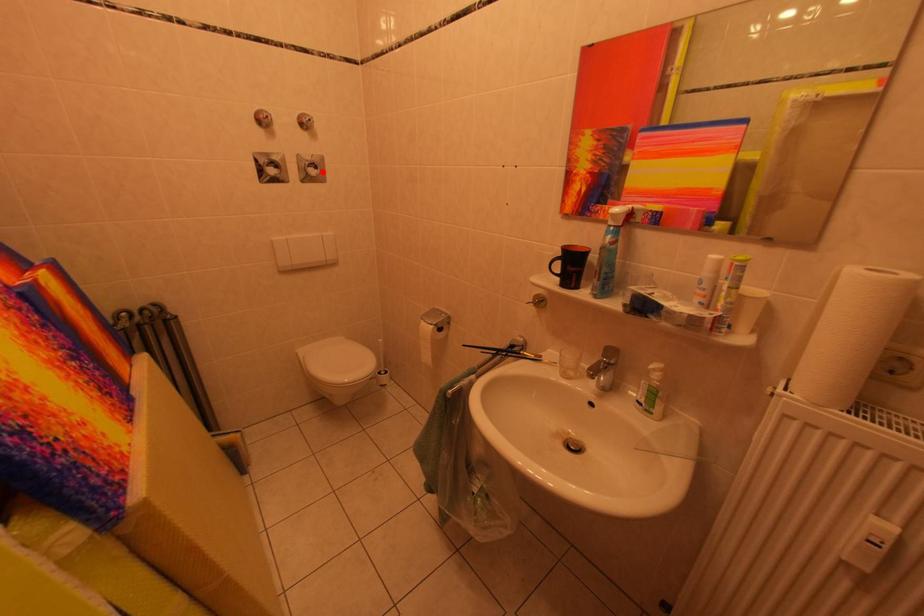
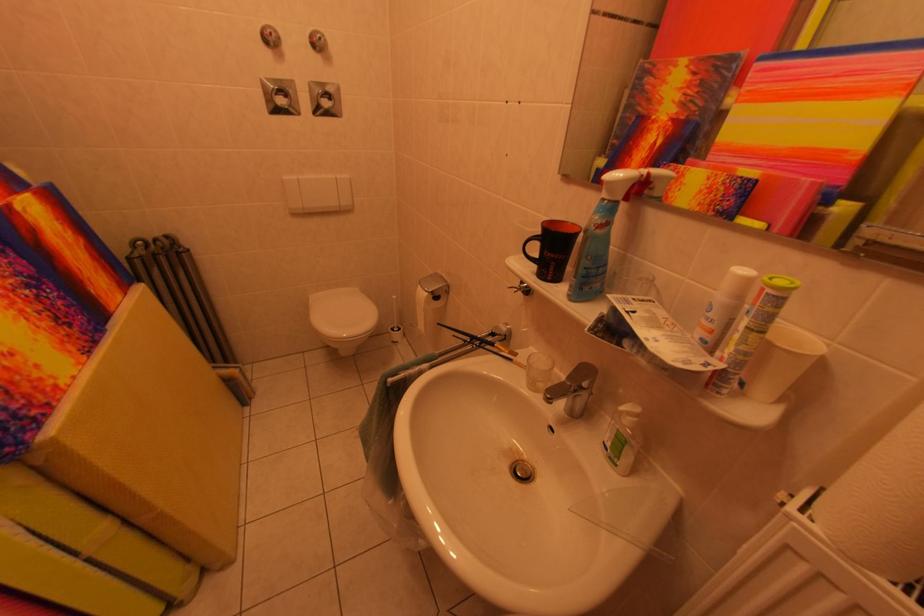
Locate, in the second image, the point that corresponds to the highlighted location in the first image.

(334, 103)